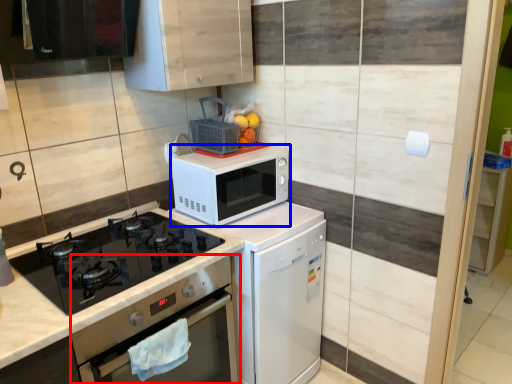
Question: Which object appears closest to the camera in this image, oven (highlighted by a red box) or microwave oven (highlighted by a blue box)?

Choices:
 (A) oven
 (B) microwave oven

Answer: (A)